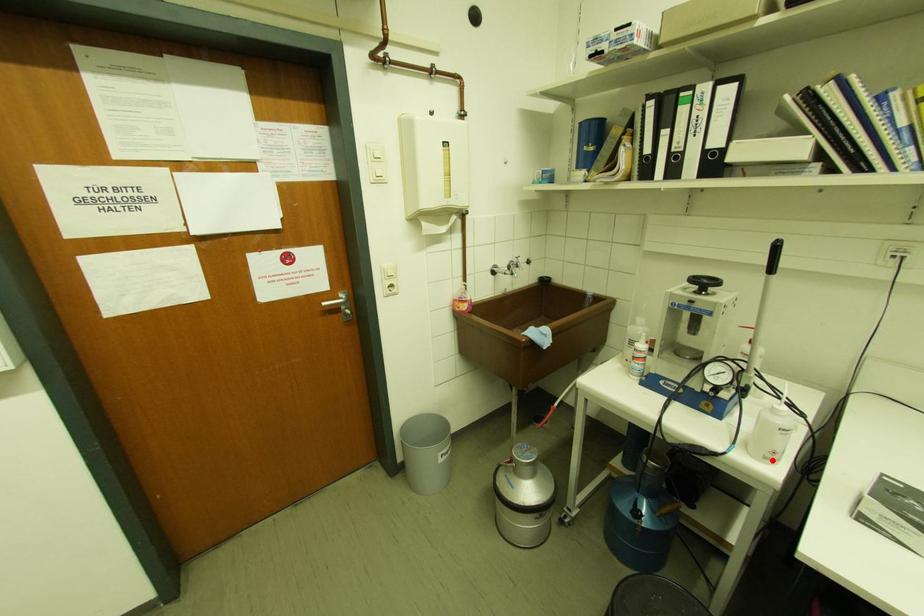
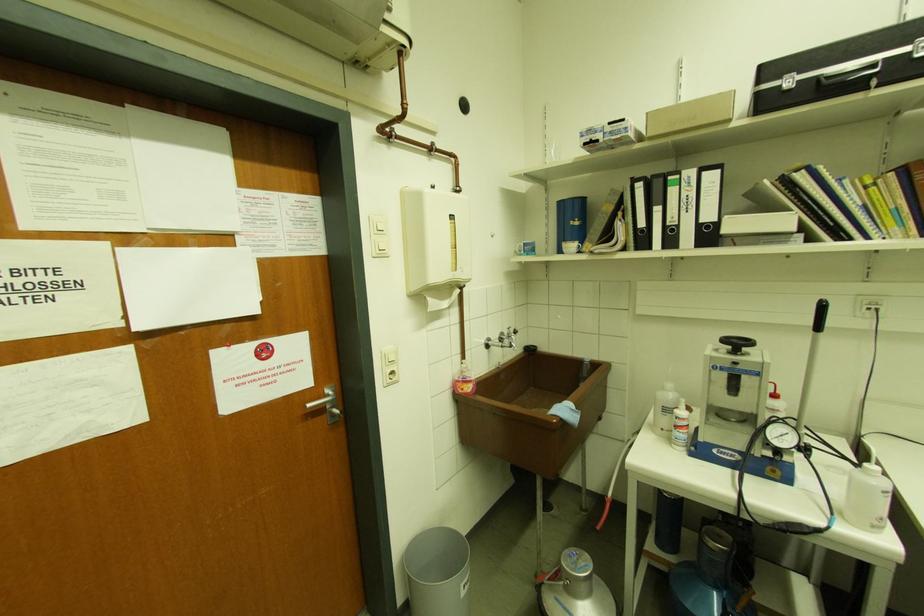
Question: I am providing you with two images of the same scene from different viewpoints. In image1, a red point is highlighted. Considering the same 3D point in image2, which of the following is correct?

Choices:
 (A) It is closer
 (B) It is farther

Answer: (B)